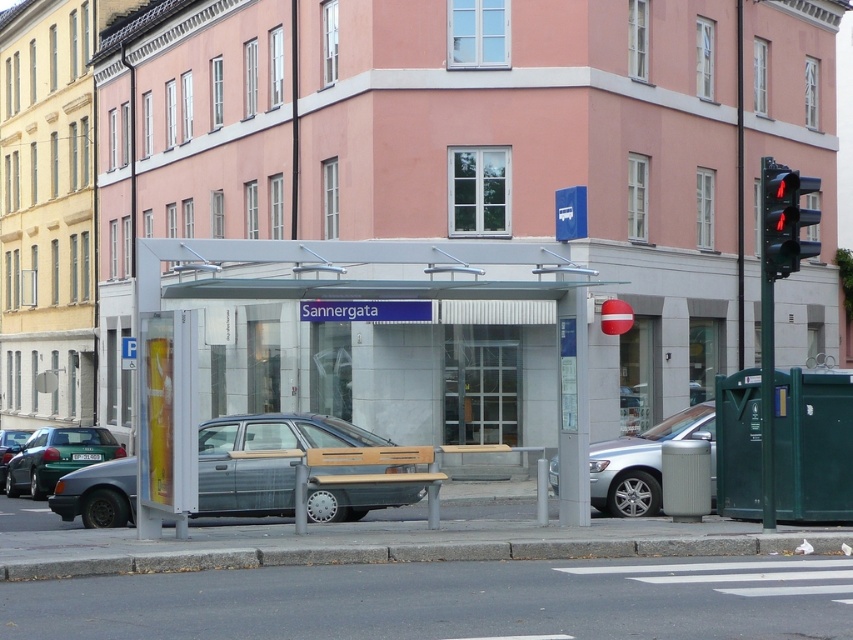
You are a pedestrian standing at the bus stop and want to cross the street. There is a metallic gray car at center and a matte gray sedan at lower left. Which vehicle is closer to you?

The metallic gray car at center is closer to you than the matte gray sedan at lower left.